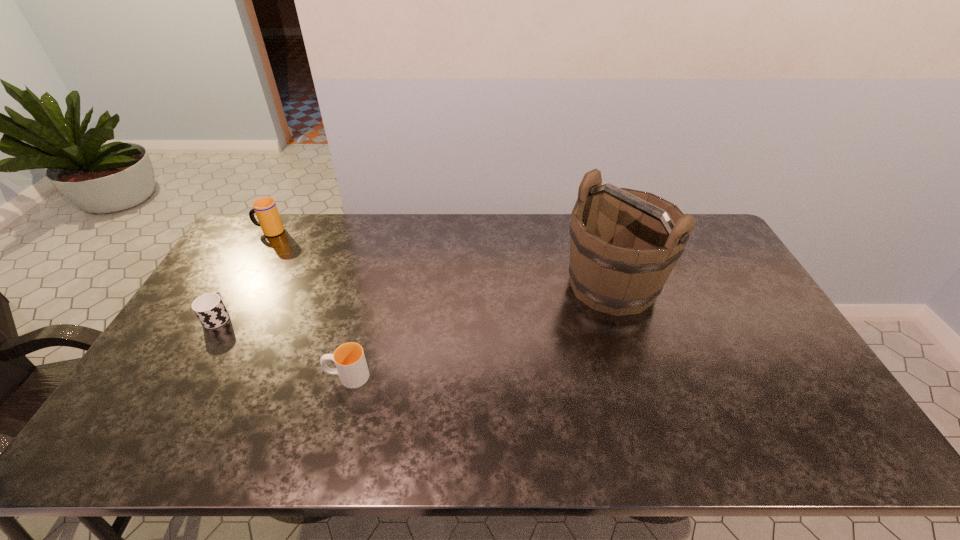
Image resolution: width=960 pixels, height=540 pixels. Identify the location of vacant space at the left edge of the desktop. tap(190, 379).

At what (x,y) coordinates should I click in order to perform the action: click on free space at the right edge of the desktop. Please return your answer as a coordinate pair (x, y). Looking at the image, I should click on (727, 278).

This screenshot has height=540, width=960. Identify the location of vacant space at the near left corner of the desktop. (167, 450).

The image size is (960, 540). What are the coordinates of `vacant space in between the tallest cup and the tallest object` in the screenshot? It's located at (441, 258).

In order to click on vacant area that lies between the rightmost object and the shortest object in this screenshot , I will do `click(415, 301)`.

Locate an element on the screen. This screenshot has height=540, width=960. vacant area that lies between the tallest object and the second tallest object is located at coordinates (441, 258).

Find the location of a particular element. The image size is (960, 540). vacant area between the rightmost object and the third tallest object is located at coordinates (480, 330).

Locate an element on the screen. This screenshot has height=540, width=960. empty location between the nearest object and the shortest object is located at coordinates (282, 347).

Locate an element on the screen. vacant space in between the nearest object and the rightmost object is located at coordinates (480, 330).

Where is `free spot between the tallest object and the shortest object`? This screenshot has height=540, width=960. free spot between the tallest object and the shortest object is located at coordinates (415, 301).